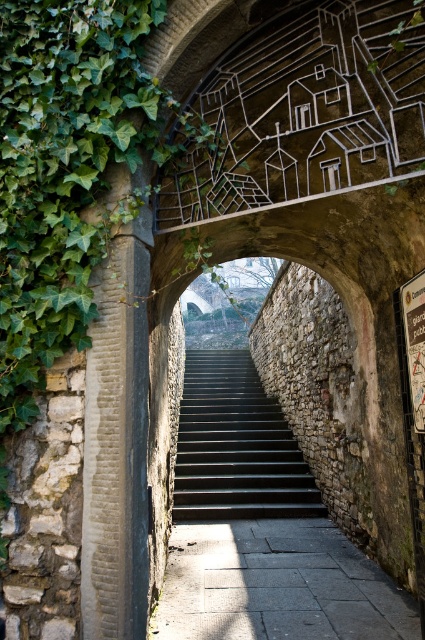
You are standing at the entrance of the archway and want to walk down the gray concrete path at center and the dark gray stone stairs at center. Which one is located to the right side of the other?

The gray concrete path at center is to the right of the dark gray stone stairs at center.

You are standing at the entrance of the archway and need to walk to the bottom of the stairs. Which object should you step on first, the gray concrete path at center or the dark gray stone stairs at center?

You should step on the gray concrete path at center first because it is lower than the dark gray stone stairs at center.

You are standing at the entrance of the stone archway and want to walk towards the gray concrete path at center. According to the coordinates provided, is the path directly in front of you or to the side?

The gray concrete path at center is located at point (275, 584), which means it is directly in front of you along the central axis of the archway, so you should walk straight ahead to reach it.